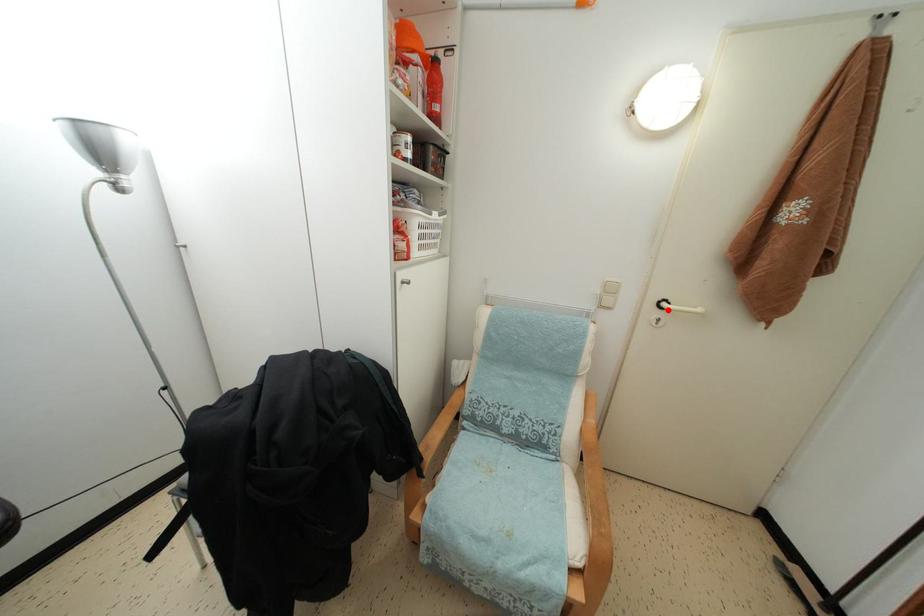
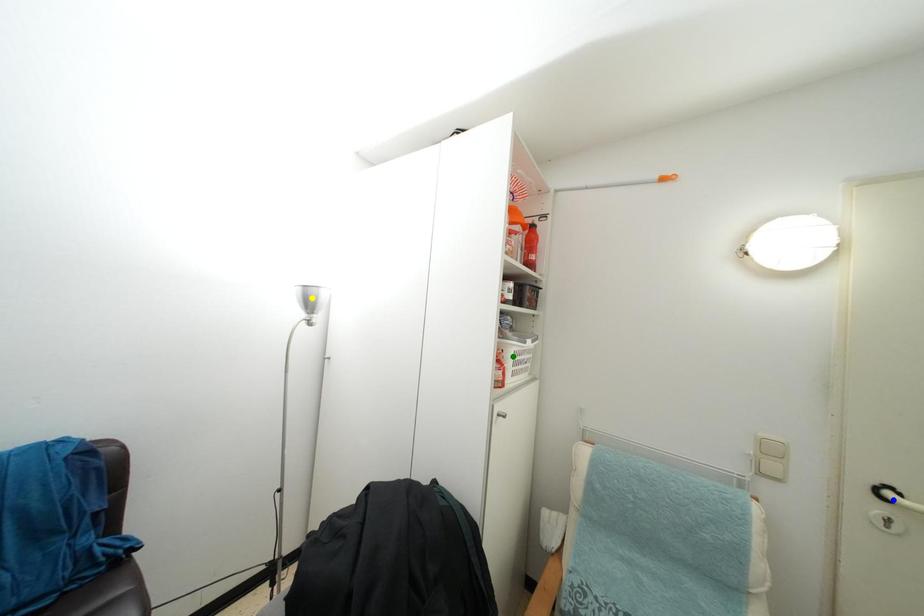
Question: I am providing you with two images of the same scene from different viewpoints. A red point is marked on the first image. You are given multiple points on the second image. Can you choose the point in image 2 that corresponds to the point in image 1?

Choices:
 (A) green point
 (B) yellow point
 (C) blue point

Answer: (C)